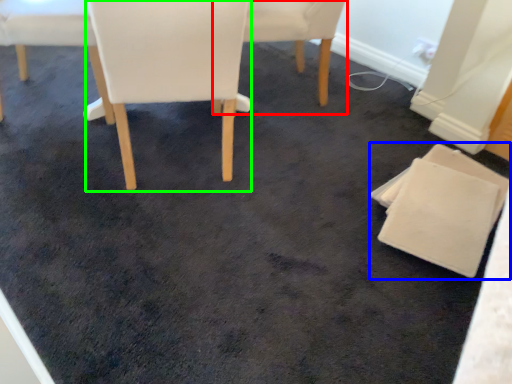
Question: Estimate the real-world distances between objects in this image. Which object is closer to chair (highlighted by a red box), chair (highlighted by a blue box) or chair (highlighted by a green box)?

Choices:
 (A) chair
 (B) chair

Answer: (B)